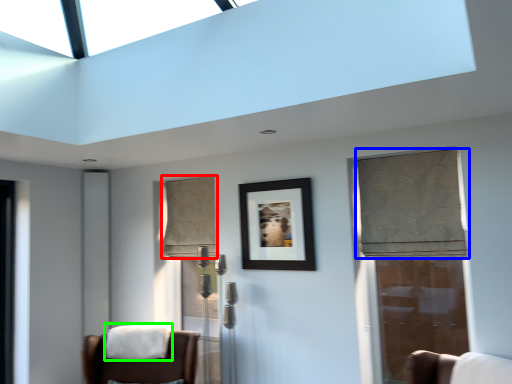
Question: Which object is positioned farthest from curtain (highlighted by a red box)? Select from curtain (highlighted by a blue box) and blanket (highlighted by a green box).

Choices:
 (A) curtain
 (B) blanket

Answer: (A)